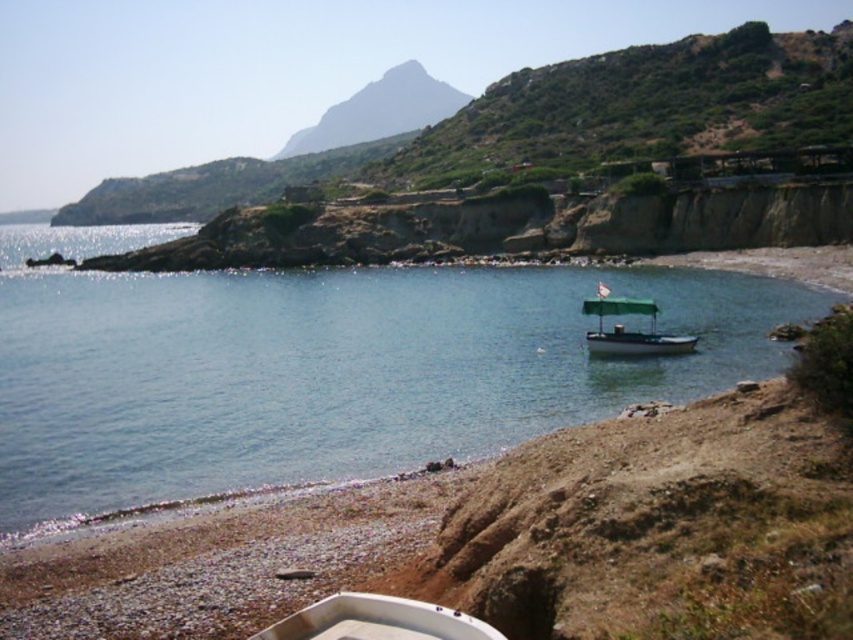
Question: Can you confirm if white plastic boat at lower center is positioned to the right of green canvas boat at center?

Choices:
 (A) no
 (B) yes

Answer: (A)

Question: Which point is closer to the camera?

Choices:
 (A) white plastic boat at lower center
 (B) green canvas boat at center
 (C) clear blue water at center

Answer: (A)

Question: Among these points, which one is farthest from the camera?

Choices:
 (A) (643, 346)
 (B) (257, 637)

Answer: (A)

Question: Where is clear blue water at center located in relation to green canvas boat at center in the image?

Choices:
 (A) right
 (B) left

Answer: (B)

Question: Can you confirm if white plastic boat at lower center is thinner than green canvas boat at center?

Choices:
 (A) yes
 (B) no

Answer: (A)

Question: Which point is closer to the camera?

Choices:
 (A) (633, 305)
 (B) (428, 604)
 (C) (103, 243)

Answer: (B)